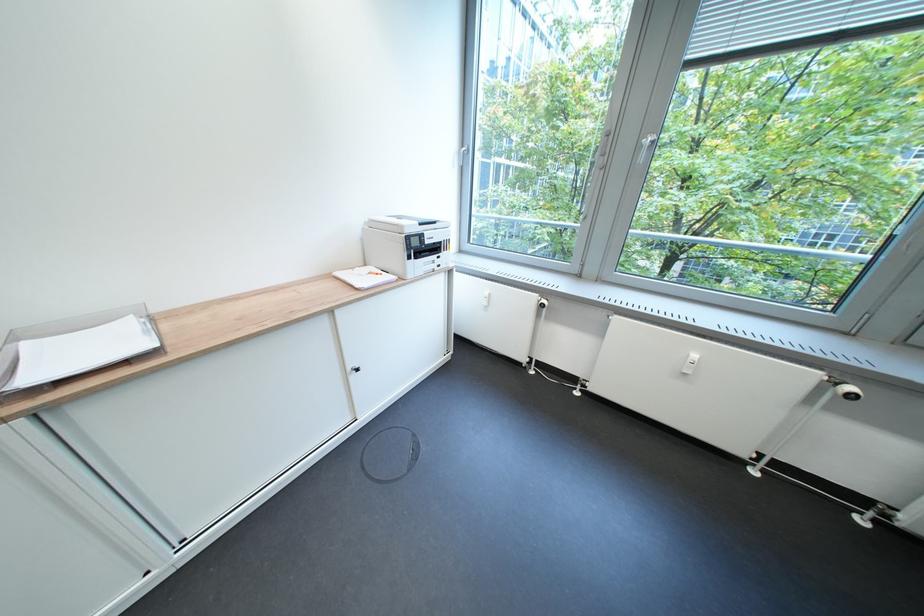
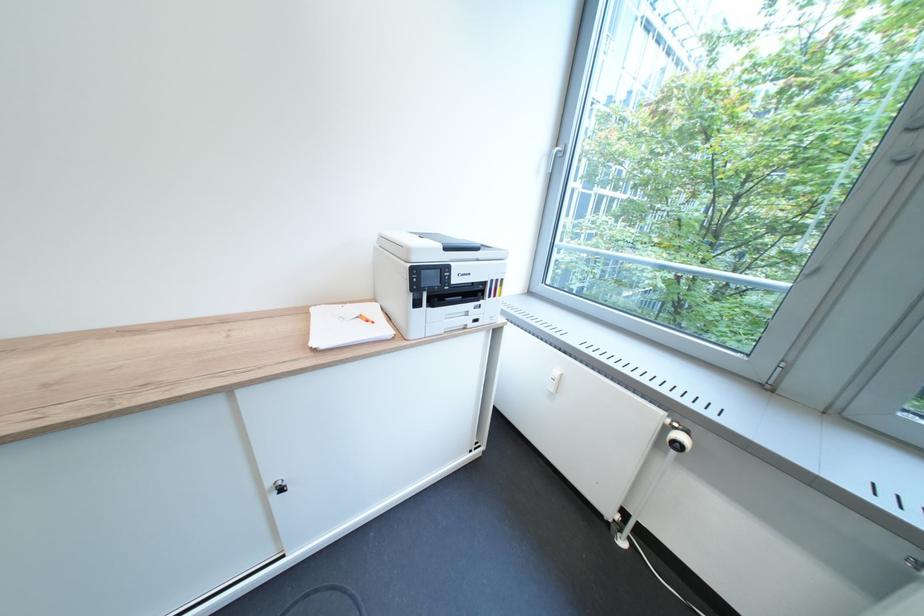
Find the pixel in the second image that matches the point at 451,267 in the first image.

(489, 322)